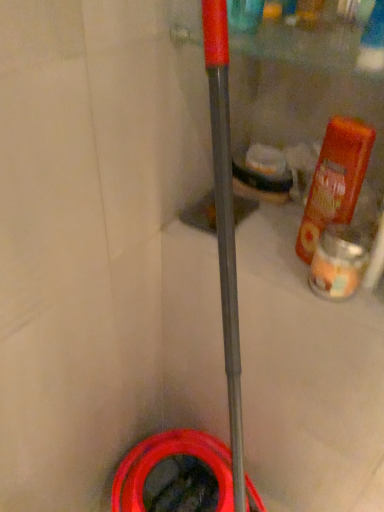
Question: In the image, is translucent glass candle at right positioned in front of or behind rubber/matte garden hose at lower center?

Choices:
 (A) front
 (B) behind

Answer: (A)

Question: From the image's perspective, relative to rubber/matte garden hose at lower center, is translucent glass candle at right above or below?

Choices:
 (A) below
 (B) above

Answer: (B)

Question: Based on their relative distances, which object is nearer to the translucent glass candle at right?

Choices:
 (A) orange matte bottle at right
 (B) rubber/matte garden hose at lower center

Answer: (A)

Question: Which is nearer to the translucent glass candle at right?

Choices:
 (A) orange matte bottle at right
 (B) rubber/matte garden hose at lower center

Answer: (A)